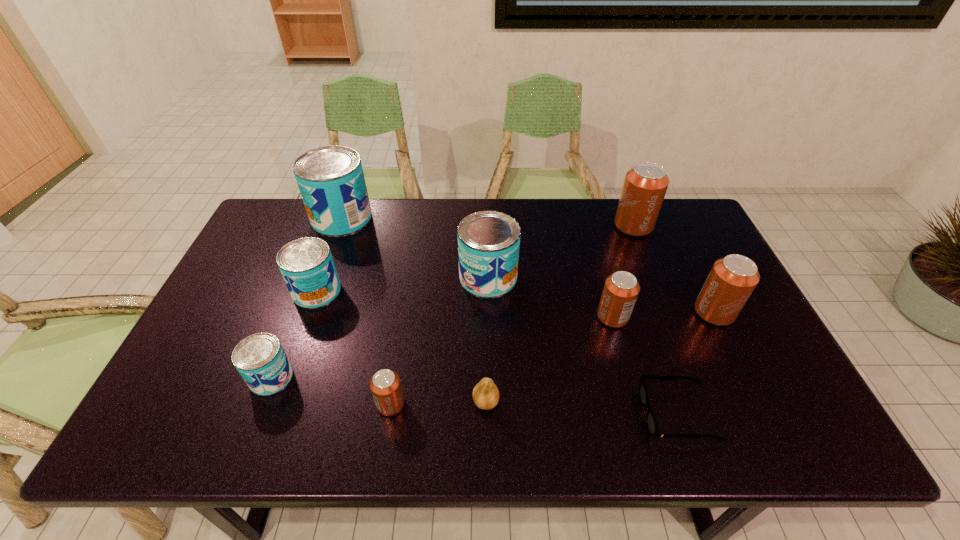
Locate an element on the screen. The width and height of the screenshot is (960, 540). pear is located at coordinates (485, 394).

Where is `the smallest blue can`? This screenshot has height=540, width=960. the smallest blue can is located at coordinates (260, 359).

Identify the location of the fifth can from right to left. (385, 385).

Where is `the leftmost orange can`? the leftmost orange can is located at coordinates point(385,385).

This screenshot has width=960, height=540. In order to click on spectacles in this screenshot , I will do `click(651, 422)`.

I want to click on black spectacles, so click(651, 422).

You are a GUI agent. You are given a task and a screenshot of the screen. Output one action in this format:
    pyautogui.click(x=<x>, y=<y>)
    Task: Click on the free location located 0.050m on the right of the biggest blue can
    
    Given the screenshot: What is the action you would take?
    pyautogui.click(x=386, y=218)

Locate an element on the screen. The image size is (960, 540). vacant position located on the front of the biggest orange can is located at coordinates (649, 266).

Locate an element on the screen. The image size is (960, 540). vacant space located 0.130m on the back of the rightmost blue can is located at coordinates (488, 231).

Image resolution: width=960 pixels, height=540 pixels. I want to click on vacant space located on the left of the second biggest orange can, so click(585, 312).